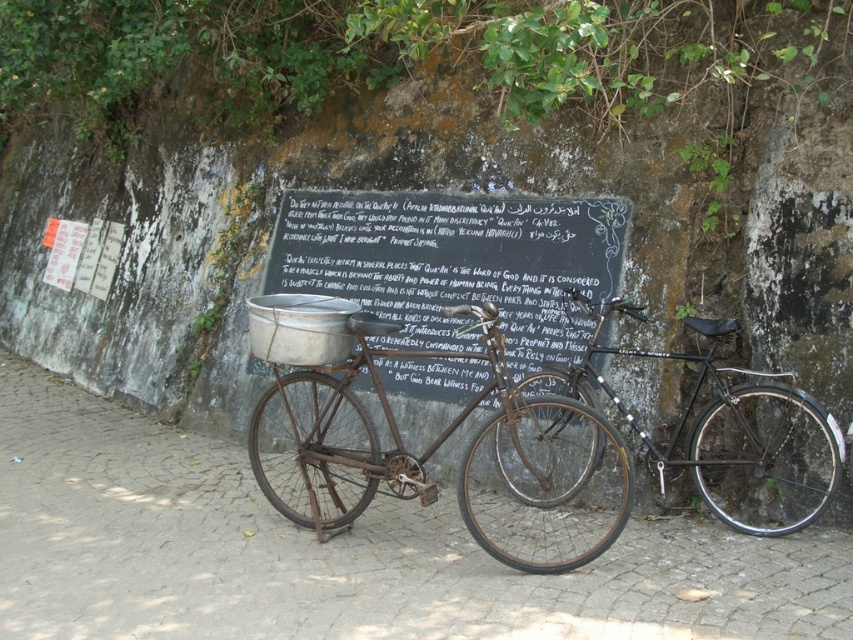
Which is behind, point (309, 484) or point (598, 253)?

The point (598, 253) is behind.

Who is taller, rusty metal bicycle at center or black chalkboard at center?

black chalkboard at center

Is point (404, 484) closer to viewer compared to point (351, 227)?

Yes, it is in front of point (351, 227).

The height and width of the screenshot is (640, 853). What are the coordinates of `rusty metal bicycle at center` in the screenshot? It's located at pos(438,449).

Measure the distance from rusty metal bicycle at center to black matte bicycle at center.

rusty metal bicycle at center is 17.44 inches away from black matte bicycle at center.

Can you confirm if rusty metal bicycle at center is positioned below black matte bicycle at center?

Actually, rusty metal bicycle at center is above black matte bicycle at center.

Between point (619, 497) and point (527, 492), which one is positioned behind?

The point (527, 492) is more distant.

I want to click on rusty metal bicycle at center, so click(438, 449).

Is point (555, 205) closer to viewer compared to point (526, 444)?

No, it is behind (526, 444).

Does black chalkboard at center have a smaller size compared to black matte bicycle at center?

No, black chalkboard at center is not smaller than black matte bicycle at center.

Is point (308, 237) in front of point (691, 326)?

No, (308, 237) is behind (691, 326).

This screenshot has width=853, height=640. Find the location of `black chalkboard at center`. black chalkboard at center is located at coordinates (451, 260).